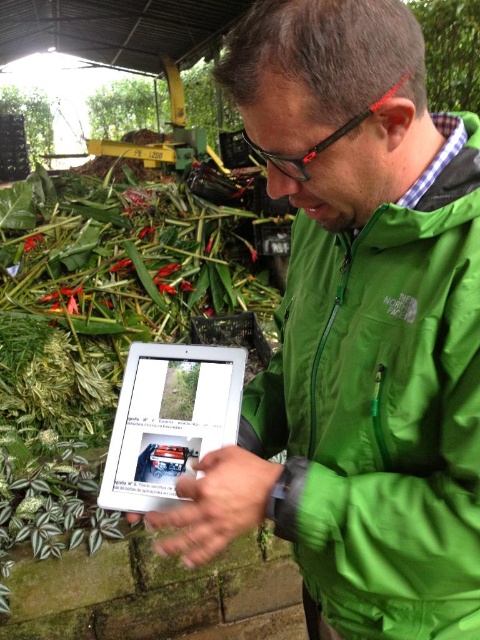
Where is `green fabric jacket at center`? This screenshot has height=640, width=480. green fabric jacket at center is located at coordinates (383, 406).

Is point (372, 236) farther from viewer compared to point (100, 202)?

No, (372, 236) is closer to viewer.

Image resolution: width=480 pixels, height=640 pixels. What are the coordinates of `green fabric jacket at center` in the screenshot? It's located at pos(383,406).

Find the location of a particular element. The height and width of the screenshot is (640, 480). green fabric jacket at center is located at coordinates (383, 406).

Can you confirm if green leafy plant at center is positioned to the right of silver metallic tablet at center?

In fact, green leafy plant at center is to the left of silver metallic tablet at center.

Does point (144, 275) come in front of point (187, 369)?

No, (144, 275) is further to viewer.

This screenshot has width=480, height=640. In order to click on green leafy plant at center in this screenshot , I will do `click(92, 332)`.

Find the location of a particular element. green leafy plant at center is located at coordinates tap(92, 332).

How distant is green fabric jacket at center from silver metallic tablet at center?

A distance of 7.97 inches exists between green fabric jacket at center and silver metallic tablet at center.

Who is shorter, green fabric jacket at center or silver metallic tablet at center?

With less height is silver metallic tablet at center.

Locate an element on the screen. green fabric jacket at center is located at coordinates (383, 406).

I want to click on green fabric jacket at center, so click(x=383, y=406).